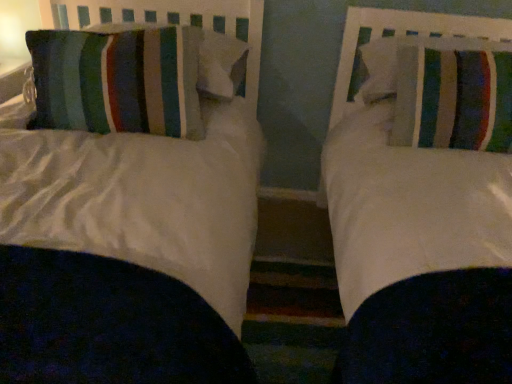
Question: Would you say striped fabric pillow at right, which appears as the first pillow when viewed from the right, is outside striped fabric pillow at right, the second pillow when ordered from right to left?

Choices:
 (A) yes
 (B) no

Answer: (A)

Question: From a real-world perspective, is striped fabric pillow at right, which appears as the first pillow when viewed from the right, under striped fabric pillow at right, the 3th pillow viewed from the left?

Choices:
 (A) no
 (B) yes

Answer: (A)

Question: Considering the relative positions of striped fabric pillow at right, marked as the 4th pillow in a left-to-right arrangement, and striped fabric pillow at right, the 3th pillow viewed from the left, in the image provided, is striped fabric pillow at right, marked as the 4th pillow in a left-to-right arrangement, behind striped fabric pillow at right, the 3th pillow viewed from the left,?

Choices:
 (A) no
 (B) yes

Answer: (B)

Question: Is striped fabric pillow at right, marked as the 4th pillow in a left-to-right arrangement, facing towards striped fabric pillow at right, the 3th pillow viewed from the left?

Choices:
 (A) yes
 (B) no

Answer: (B)

Question: Considering the relative sizes of striped fabric pillow at right, which appears as the first pillow when viewed from the right, and striped fabric pillow at right, the 3th pillow viewed from the left, in the image provided, is striped fabric pillow at right, which appears as the first pillow when viewed from the right, smaller than striped fabric pillow at right, the 3th pillow viewed from the left,?

Choices:
 (A) no
 (B) yes

Answer: (B)

Question: Is striped fabric pillow at right, the second pillow when ordered from right to left, spatially inside striped fabric pillow at left, the fourth pillow when ordered from right to left, or outside of it?

Choices:
 (A) inside
 (B) outside

Answer: (B)

Question: Considering the positions of striped fabric pillow at right, the second pillow when ordered from right to left, and striped fabric pillow at left, the fourth pillow when ordered from right to left, in the image, is striped fabric pillow at right, the second pillow when ordered from right to left, wider or thinner than striped fabric pillow at left, the fourth pillow when ordered from right to left,?

Choices:
 (A) wide
 (B) thin

Answer: (A)

Question: In terms of size, does striped fabric pillow at right, the second pillow when ordered from right to left, appear bigger or smaller than striped fabric pillow at left, the fourth pillow when ordered from right to left?

Choices:
 (A) big
 (B) small

Answer: (B)

Question: Does point (412, 71) appear closer or farther from the camera than point (120, 59)?

Choices:
 (A) farther
 (B) closer

Answer: (A)

Question: Looking at the image, does striped fabric pillow at right, which appears as the first pillow when viewed from the right, seem bigger or smaller compared to striped fabric pillow at left, acting as the 1th pillow starting from the left?

Choices:
 (A) big
 (B) small

Answer: (B)

Question: Is striped fabric pillow at right, marked as the 4th pillow in a left-to-right arrangement, taller or shorter than striped fabric pillow at left, the fourth pillow when ordered from right to left?

Choices:
 (A) tall
 (B) short

Answer: (B)

Question: Relative to striped fabric pillow at left, acting as the 1th pillow starting from the left, is striped fabric pillow at right, which appears as the first pillow when viewed from the right, in front or behind?

Choices:
 (A) front
 (B) behind

Answer: (B)

Question: Would you say striped fabric pillow at right, marked as the 4th pillow in a left-to-right arrangement, is inside or outside striped fabric pillow at left, the fourth pillow when ordered from right to left?

Choices:
 (A) inside
 (B) outside

Answer: (B)

Question: Looking at their shapes, would you say striped fabric pillow at right, which appears as the first pillow when viewed from the right, is wider or thinner than striped fabric pillow at left, acting as the 3th pillow starting from the right?

Choices:
 (A) wide
 (B) thin

Answer: (B)

Question: In terms of size, does striped fabric pillow at right, marked as the 4th pillow in a left-to-right arrangement, appear bigger or smaller than striped fabric pillow at left, the second pillow when ordered from left to right?

Choices:
 (A) big
 (B) small

Answer: (B)